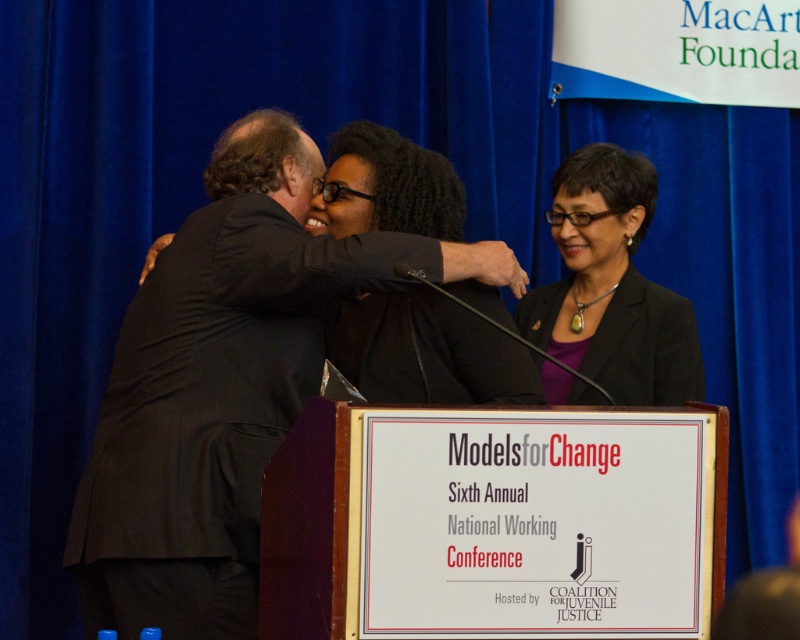
Which is in front, point (184, 458) or point (614, 340)?

Positioned in front is point (184, 458).

Can you confirm if black suit at center is thinner than matte black blazer at center?

No, black suit at center is not thinner than matte black blazer at center.

The image size is (800, 640). I want to click on black suit at center, so click(224, 385).